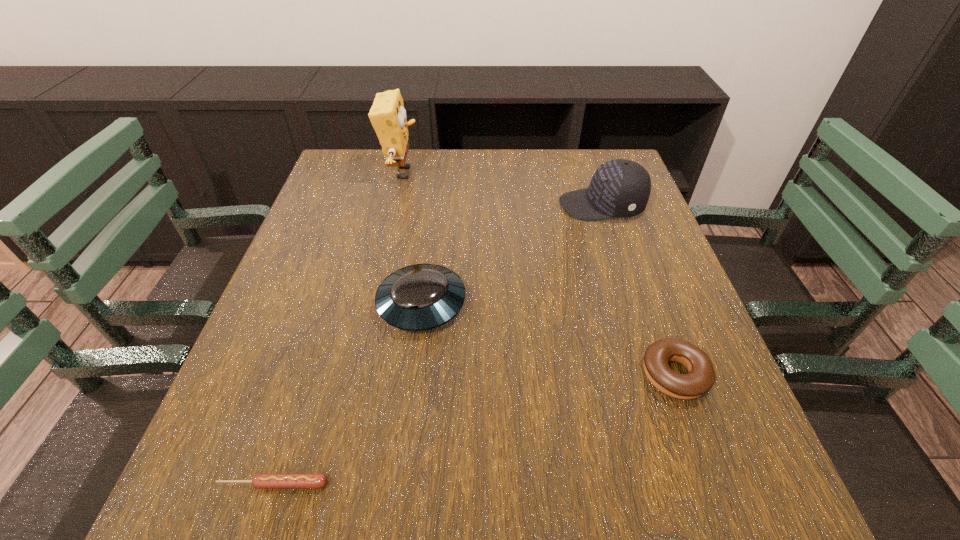
This screenshot has width=960, height=540. What are the coordinates of `free space located at the front of the baseball cap where the brim is located` in the screenshot? It's located at tap(485, 206).

This screenshot has width=960, height=540. Identify the location of free point located 0.110m at the front of the baseball cap where the brim is located. (516, 206).

Where is `vacant space located on the front of the third farthest object`? vacant space located on the front of the third farthest object is located at coordinates (414, 366).

Find the location of `free space located on the back of the doughnut`. free space located on the back of the doughnut is located at coordinates (618, 221).

The image size is (960, 540). I want to click on free region located on the back of the shortest object, so click(x=286, y=444).

This screenshot has height=540, width=960. I want to click on sponge situated at the far edge, so click(387, 115).

Where is `baseball cap that is at the far edge`? The width and height of the screenshot is (960, 540). baseball cap that is at the far edge is located at coordinates (620, 188).

Locate an element on the screen. This screenshot has height=540, width=960. object at the near edge is located at coordinates (260, 481).

Where is `sponge present at the left edge`? sponge present at the left edge is located at coordinates (387, 115).

At what (x,y) coordinates should I click in order to perform the action: click on sausage present at the left edge. Please return your answer as a coordinate pair (x, y). This screenshot has width=960, height=540. Looking at the image, I should click on (260, 481).